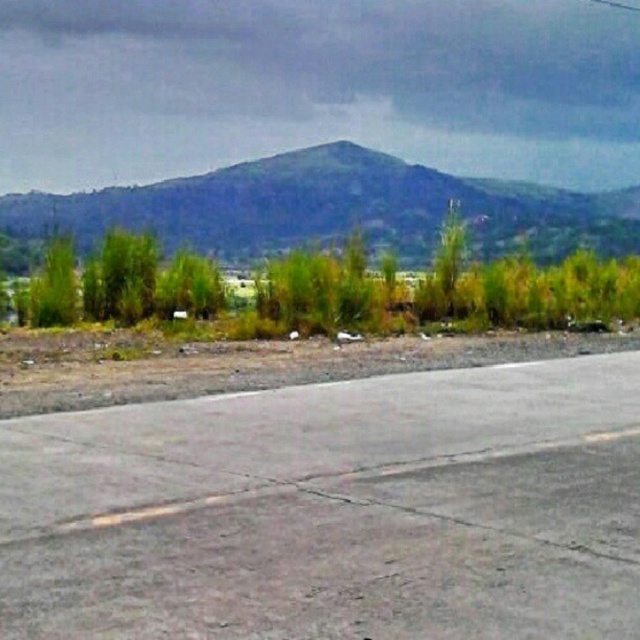
You are driving a car and see the gray asphalt tarmac at lower center and the green grassy hill at upper center in your view. Which object is closer to your car?

The gray asphalt tarmac at lower center is closer to your car because it is positioned below the green grassy hill at upper center, indicating it is nearer in the scene.

In the scene shown: You are driving a car along the gray asphalt tarmac at lower center and want to reach the green grassy hill at upper center. Which direction should you turn to get there?

The gray asphalt tarmac at lower center is to the left of the green grassy hill at upper center, so you should turn right to reach it.